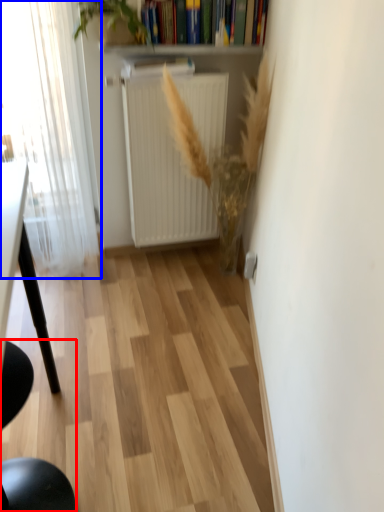
Question: Which point is closer to the camera, chair (highlighted by a red box) or window (highlighted by a blue box)?

Choices:
 (A) chair
 (B) window

Answer: (A)